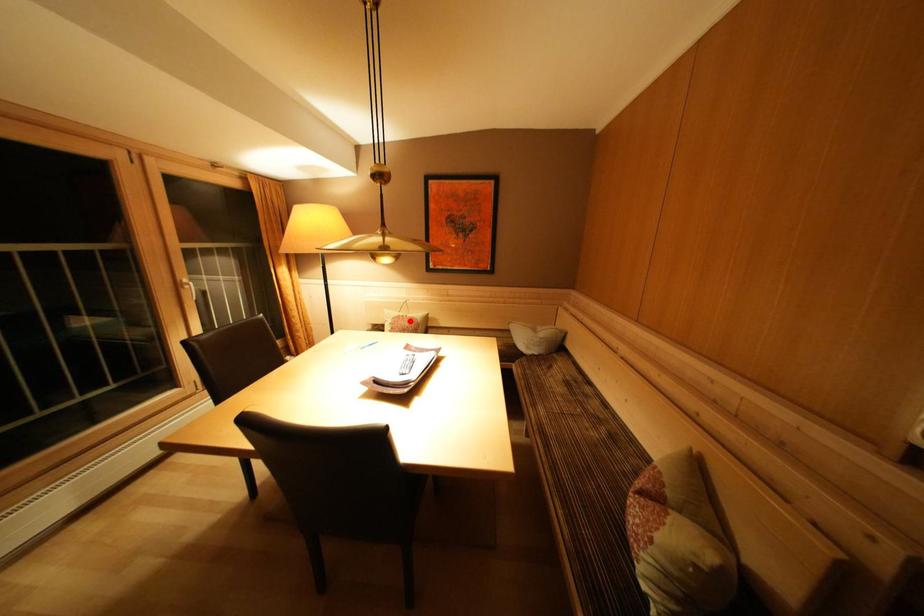
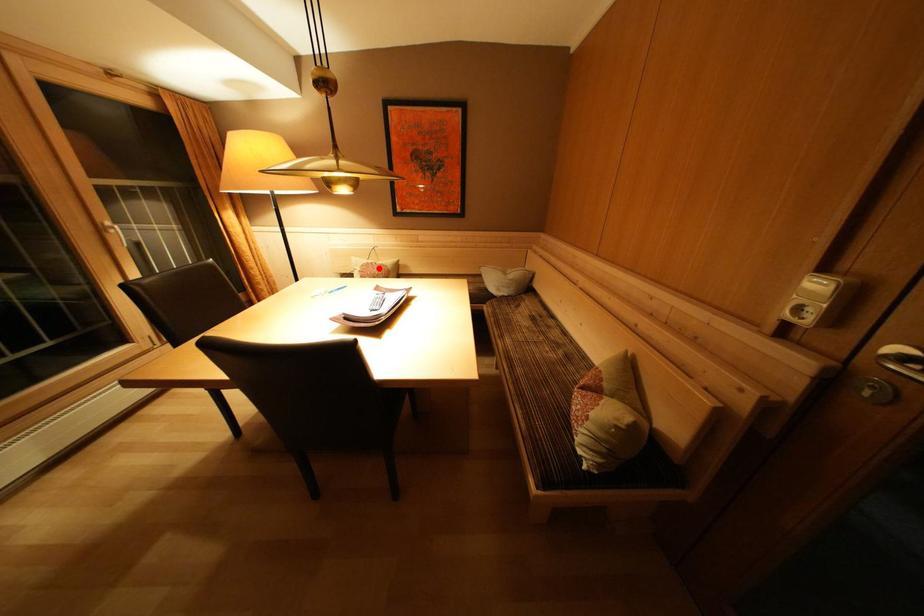
I am providing you with two images of the same scene from different viewpoints. A red point is marked on the first image and another point is marked on the second image. Does the point marked in image1 correspond to the same location as the one in image2?

Yes